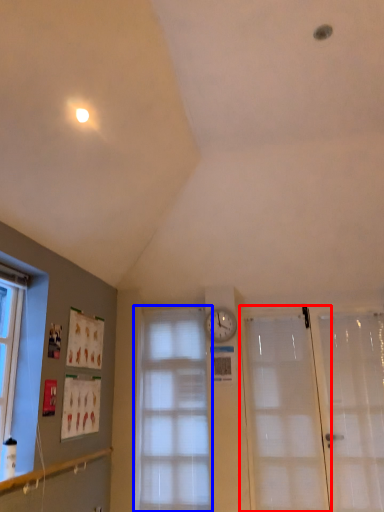
Question: Which object is further to the camera taking this photo, door (highlighted by a red box) or window (highlighted by a blue box)?

Choices:
 (A) door
 (B) window

Answer: (B)